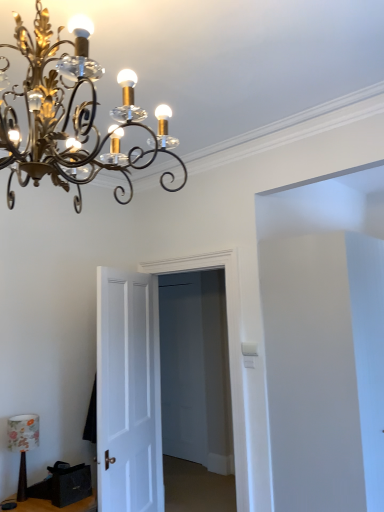
Question: Can you confirm if black fabric speaker at lower left is positioned to the left of white matte door at center, positioned as the 1th door in left-to-right order?

Choices:
 (A) no
 (B) yes

Answer: (B)

Question: Could white matte door at center, positioned as the 1th door in left-to-right order, be considered to be inside black fabric speaker at lower left?

Choices:
 (A) yes
 (B) no

Answer: (B)

Question: From a real-world perspective, does black fabric speaker at lower left stand above white matte door at center, positioned as the 1th door in left-to-right order?

Choices:
 (A) no
 (B) yes

Answer: (A)

Question: Can you confirm if black fabric speaker at lower left is positioned to the right of white matte door at center, placed as the second door when sorted from right to left?

Choices:
 (A) yes
 (B) no

Answer: (B)

Question: From a real-world perspective, is black fabric speaker at lower left under white matte door at center, placed as the second door when sorted from right to left?

Choices:
 (A) yes
 (B) no

Answer: (A)

Question: Is black fabric speaker at lower left looking in the opposite direction of white matte door at center, placed as the second door when sorted from right to left?

Choices:
 (A) yes
 (B) no

Answer: (B)

Question: Is white wooden door at center, which appears as the 1th door when viewed from the right, behind black leather drawer at lower left?

Choices:
 (A) yes
 (B) no

Answer: (A)

Question: Is the depth of white wooden door at center, positioned as the 2th door in left-to-right order, less than that of black leather drawer at lower left?

Choices:
 (A) no
 (B) yes

Answer: (A)

Question: From a real-world perspective, is white wooden door at center, positioned as the 2th door in left-to-right order, beneath black leather drawer at lower left?

Choices:
 (A) yes
 (B) no

Answer: (B)

Question: Would you say white wooden door at center, which appears as the 1th door when viewed from the right, contains black leather drawer at lower left?

Choices:
 (A) no
 (B) yes

Answer: (A)

Question: Can you confirm if white wooden door at center, which appears as the 1th door when viewed from the right, is bigger than black leather drawer at lower left?

Choices:
 (A) yes
 (B) no

Answer: (A)

Question: From a real-world perspective, is white wooden door at center, which appears as the 1th door when viewed from the right, on black leather drawer at lower left?

Choices:
 (A) no
 (B) yes

Answer: (B)

Question: From a real-world perspective, is black leather drawer at lower left located beneath gold metallic chandelier at upper left, the first lamp viewed from the top?

Choices:
 (A) no
 (B) yes

Answer: (B)